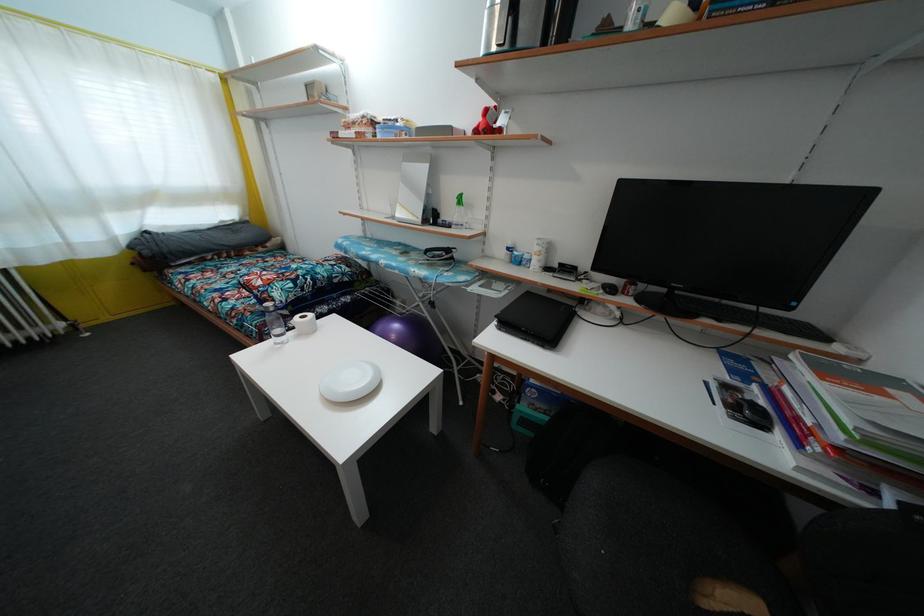
You are a GUI agent. You are given a task and a screenshot of the screen. Output one action in this format:
    pyautogui.click(x=<x>, y=<y>)
    Task: Click on the chair sitting surface
    This screenshot has height=616, width=924.
    Given the screenshot: What is the action you would take?
    655,546